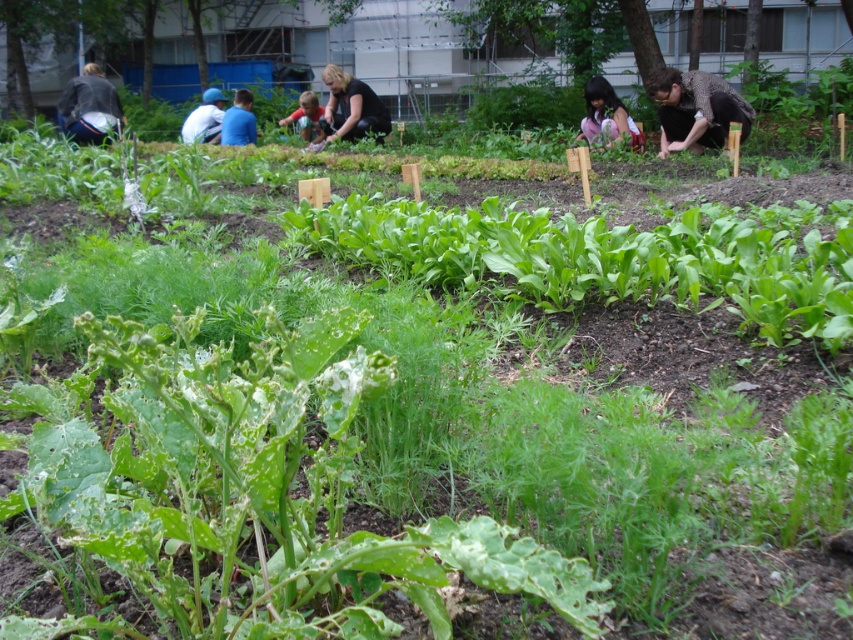
Based on the photo, you are a photographer trying to capture a wide shot of the community garden scene. You notice two people wearing the speckled brown shirt at right and the dark gray jacket at upper left. Which person should you position closer to the camera to ensure their clothing is clearly visible in the photo?

You should position the person wearing the speckled brown shirt at right closer to the camera because their shirt has a larger width than the dark gray jacket at upper left, making it more visible from a distance.

You are standing in the community garden and see a speckled brown shirt at right and a dark gray jacket at upper left. Which person is positioned more to the east?

The speckled brown shirt at right is positioned more to the east because it is to the right of the dark gray jacket at upper left, and in the image, right typically corresponds to east.

You are a photographer trying to capture a wide shot of the community garden scene. You notice the speckled brown shirt at right and the dark brown hair at center. Which of these two elements would require you to adjust your camera angle to include more horizontally?

The speckled brown shirt at right has a greater width than the dark brown hair at center, so you would need to adjust your camera angle to include more horizontal space for the speckled brown shirt at right.